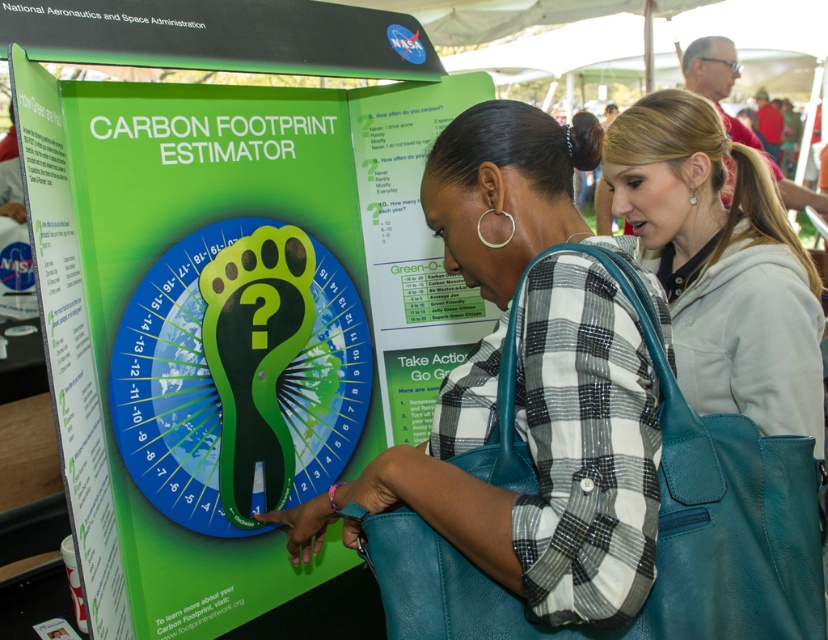
You are a photographer at the event and want to capture a photo of the teal leather handbag at center and the light gray hoodie at center. Based on their positions, which object is closer to the left edge of the photo?

The teal leather handbag at center is closer to the left edge of the photo because it is positioned to the left of the light gray hoodie at center.

What object is located at the coordinates point (537,456)?

The point (537,456) indicates the teal leather handbag at center.